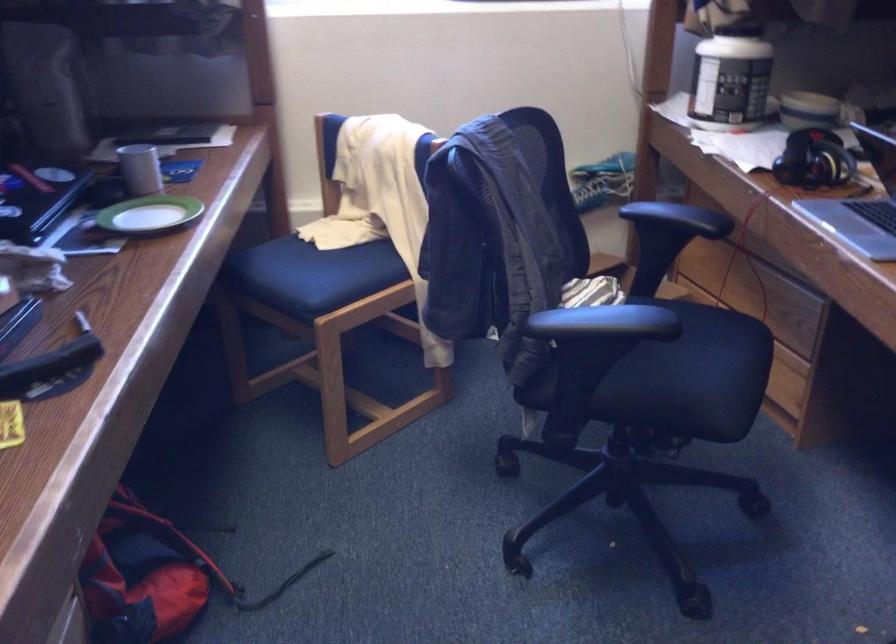
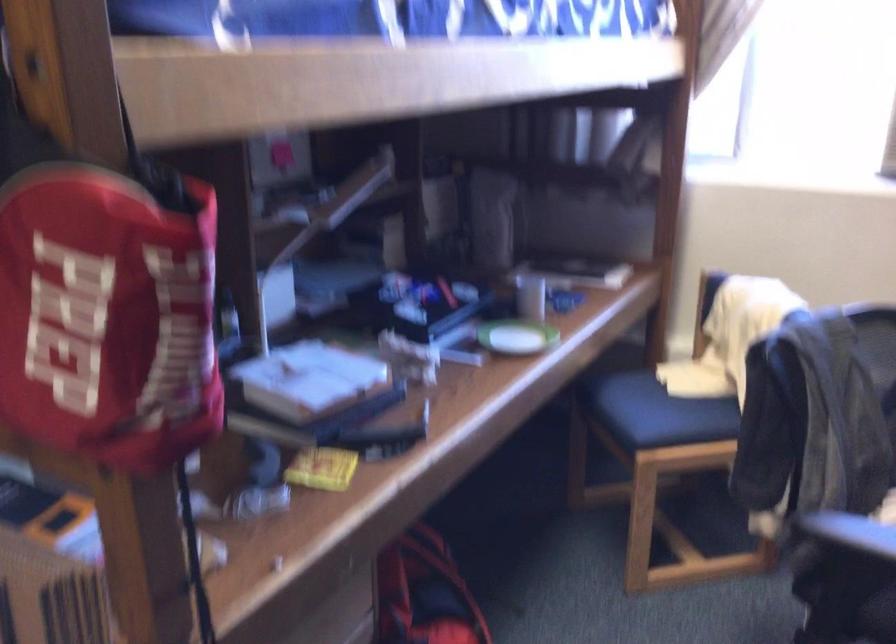
The point at (151, 167) is marked in the first image. Where is the corresponding point in the second image?

(530, 297)